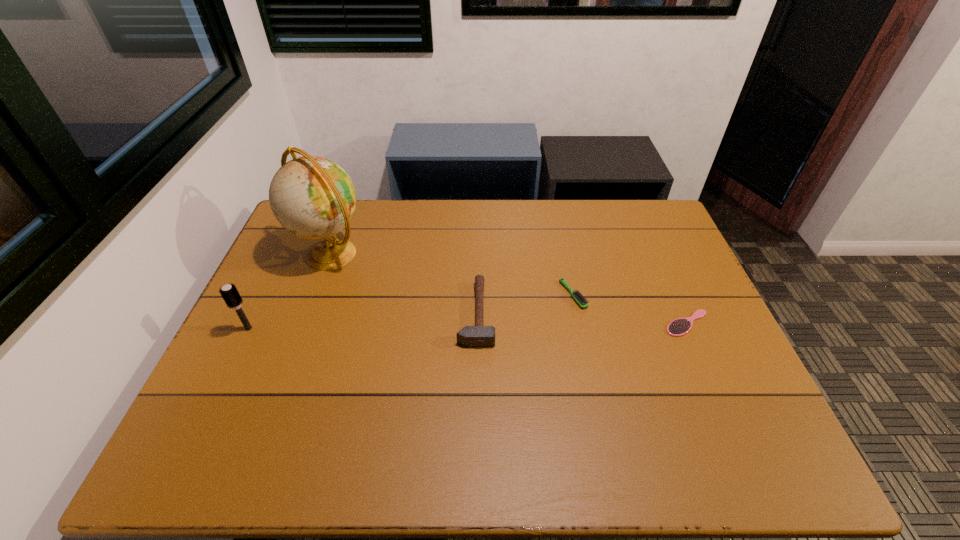
The width and height of the screenshot is (960, 540). I want to click on free spot between the fourth object from right to left and the shortest hairbrush, so click(509, 288).

Locate an element on the screen. The height and width of the screenshot is (540, 960). empty location between the leftmost object and the tallest object is located at coordinates (290, 291).

You are a GUI agent. You are given a task and a screenshot of the screen. Output one action in this format:
    pyautogui.click(x=<x>, y=<y>)
    Task: Click on the vacant space that's between the hammer and the fourth object from right to left
    This screenshot has height=540, width=960.
    Given the screenshot: What is the action you would take?
    pyautogui.click(x=403, y=284)

Where is `free space between the second tallest hairbrush and the rightmost hairbrush`? free space between the second tallest hairbrush and the rightmost hairbrush is located at coordinates (630, 309).

Where is `free space between the second shortest hairbrush and the globe`? free space between the second shortest hairbrush and the globe is located at coordinates (452, 274).

Where is `unoccupied position between the hammer and the second hairbrush from right to left`? Image resolution: width=960 pixels, height=540 pixels. unoccupied position between the hammer and the second hairbrush from right to left is located at coordinates click(x=525, y=304).

In order to click on the second closest object to the third shortest object in this screenshot , I will do pos(312,197).

Locate which object is the fourth closest to the shortest hairbrush. Please provide its 2D coordinates. Your answer should be formatted as a tuple, i.e. [(x, y)], where the tuple contains the x and y coordinates of a point satisfying the conditions above.

[(229, 292)]

You are a GUI agent. You are given a task and a screenshot of the screen. Output one action in this format:
    pyautogui.click(x=<x>, y=<y>)
    Task: Click on the hairbrush that stands as the closest to the second shortest hairbrush
    The width and height of the screenshot is (960, 540).
    Given the screenshot: What is the action you would take?
    pyautogui.click(x=681, y=326)

Select which hairbrush appears as the closest to the rightmost object. Please provide its 2D coordinates. Your answer should be formatted as a tuple, i.e. [(x, y)], where the tuple contains the x and y coordinates of a point satisfying the conditions above.

[(581, 301)]